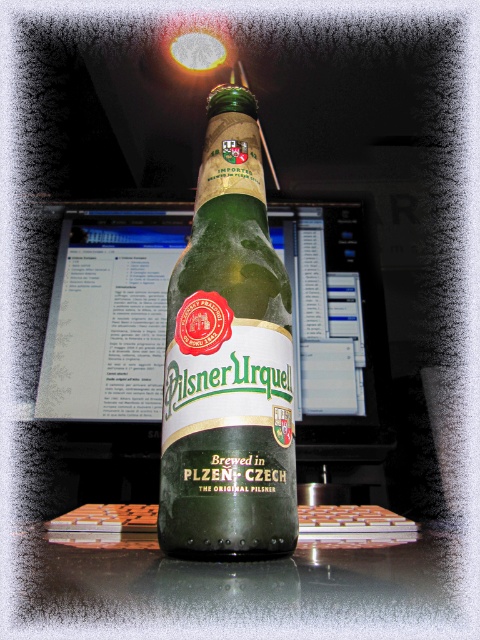
You are a delivery person who needs to place the green glass bottle at center into a storage box with a maximum height of 0.5 meters. Can you determine if it will fit based on its position in the image?

The green glass bottle at center is located at point (228, 360), but without specific height measurements, it is impossible to determine if it will fit in the storage box with a maximum height of 0.5 meters.

You are organizing a display and need to fit both the green glass bottle at center and the matte plastic monitor at center side by side on a shelf. If the shelf has just enough space for the wider object, which object should you place on the shelf first?

The matte plastic monitor at center is wider than the green glass bottle at center, so you should place the matte plastic monitor at center first to ensure it fits on the shelf.

You are organizing a display for a Czech beer festival. You have a green glass bottle at center and a matte plastic monitor at center. Which object should you place higher to ensure the monitor is visible to visitors standing at eye level?

Since the green glass bottle at center is smaller than the matte plastic monitor at center, you should place the matte plastic monitor at center higher to ensure it is visible at eye level.